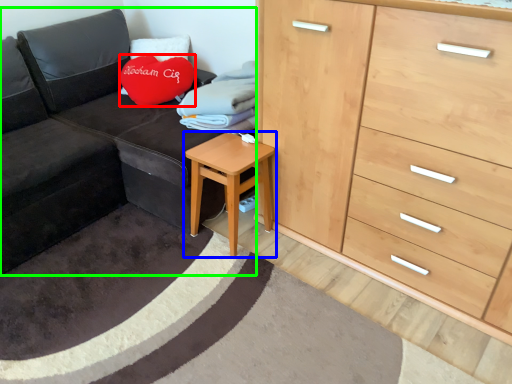
Question: Estimate the real-world distances between objects in this image. Which object is closer to throw pillow (highlighted by a red box), table (highlighted by a blue box) or studio couch (highlighted by a green box)?

Choices:
 (A) table
 (B) studio couch

Answer: (B)